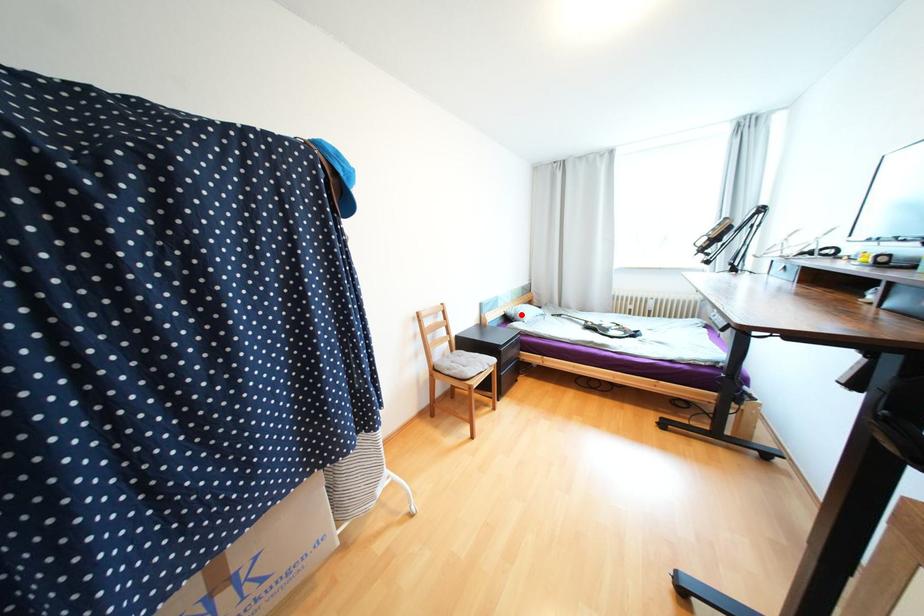
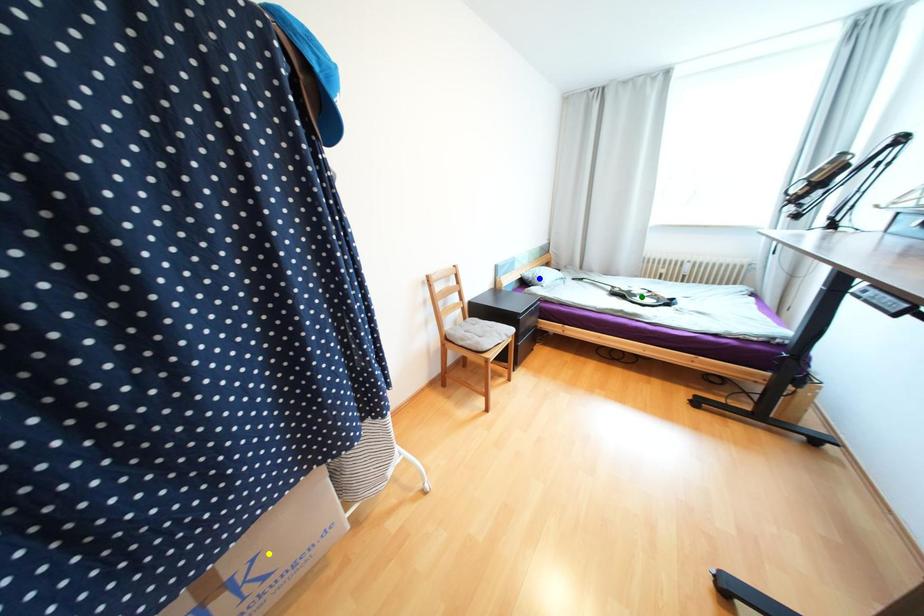
Question: I am providing you with two images of the same scene from different viewpoints. A red point is marked on the first image. You are given multiple points on the second image. Can you choose the point in image 2 that corresponds to the point in image 1?

Choices:
 (A) green point
 (B) blue point
 (C) yellow point

Answer: (B)